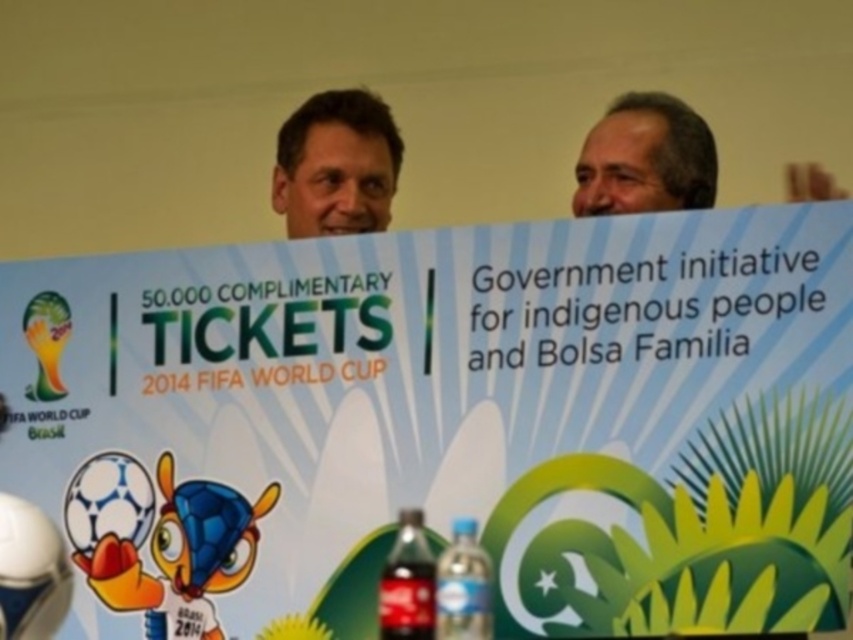
Question: Is dark glass bottle at center bigger than blue plastic bottle at lower center?

Choices:
 (A) no
 (B) yes

Answer: (B)

Question: Can you confirm if white paper sign at center is wider than blue plastic bottle at lower center?

Choices:
 (A) yes
 (B) no

Answer: (A)

Question: Among these objects, which one is farthest from the camera?

Choices:
 (A) blue plastic bottle at lower center
 (B) matte blue shirt at upper center

Answer: (B)

Question: Which point appears closest to the camera in this image?

Choices:
 (A) (456, 540)
 (B) (822, 192)

Answer: (A)

Question: Does gray matte head at upper right appear on the left side of matte blue shirt at upper center?

Choices:
 (A) yes
 (B) no

Answer: (B)

Question: Among these points, which one is nearest to the camera?

Choices:
 (A) (259, 362)
 (B) (483, 561)
 (C) (312, 97)
 (D) (399, 522)

Answer: (B)